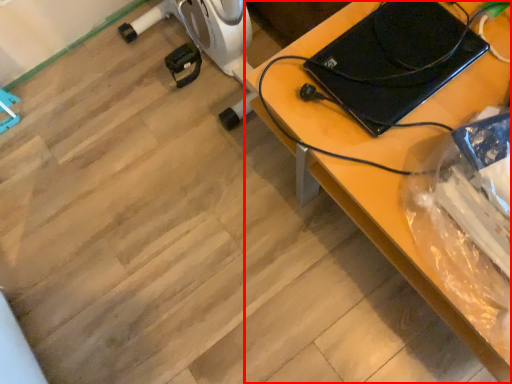
Question: Where is desk (annotated by the red box) located in relation to laptop in the image?

Choices:
 (A) right
 (B) left

Answer: (A)